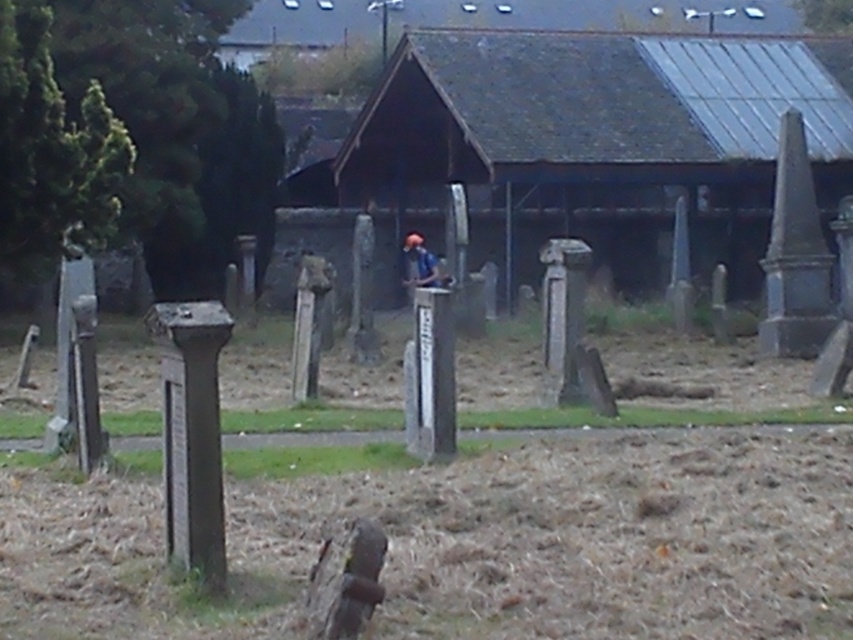
Measure the distance from dark gray wooden hut at center to matte blue shirt at center.

dark gray wooden hut at center is 7.48 meters from matte blue shirt at center.

Is dark gray wooden hut at center to the right of matte blue shirt at center from the viewer's perspective?

Yes, dark gray wooden hut at center is to the right of matte blue shirt at center.

Identify the location of dark gray wooden hut at center. This screenshot has width=853, height=640. (598, 141).

The width and height of the screenshot is (853, 640). Identify the location of dark gray wooden hut at center. (598, 141).